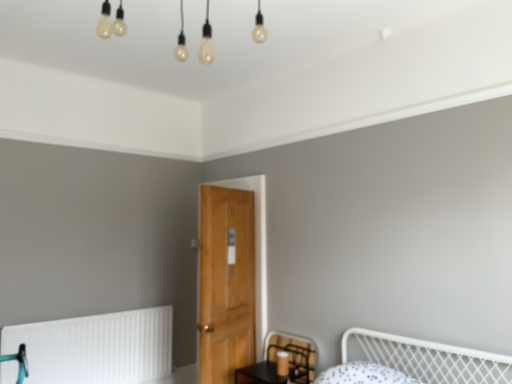
Question: Does black mesh swivel chair at lower center turn towards white matte radiator at lower left?

Choices:
 (A) no
 (B) yes

Answer: (A)

Question: From a real-world perspective, is black mesh swivel chair at lower center located beneath white matte radiator at lower left?

Choices:
 (A) no
 (B) yes

Answer: (A)

Question: Can you confirm if black mesh swivel chair at lower center is bigger than white matte radiator at lower left?

Choices:
 (A) no
 (B) yes

Answer: (A)

Question: Is black mesh swivel chair at lower center surrounding white matte radiator at lower left?

Choices:
 (A) no
 (B) yes

Answer: (A)

Question: From a real-world perspective, is black mesh swivel chair at lower center on top of white matte radiator at lower left?

Choices:
 (A) yes
 (B) no

Answer: (A)

Question: From a real-world perspective, is wooden door at center positioned above or below white matte radiator at lower left?

Choices:
 (A) above
 (B) below

Answer: (A)

Question: From the image's perspective, is wooden door at center located above or below white matte radiator at lower left?

Choices:
 (A) above
 (B) below

Answer: (A)

Question: Is wooden door at center bigger or smaller than white matte radiator at lower left?

Choices:
 (A) big
 (B) small

Answer: (A)

Question: Looking at their shapes, would you say wooden door at center is wider or thinner than white matte radiator at lower left?

Choices:
 (A) thin
 (B) wide

Answer: (B)

Question: Choose the correct answer: Is white matte radiator at lower left inside wooden door at center or outside it?

Choices:
 (A) outside
 (B) inside

Answer: (A)

Question: In terms of height, does white matte radiator at lower left look taller or shorter compared to wooden door at center?

Choices:
 (A) tall
 (B) short

Answer: (B)

Question: Is point (105, 377) positioned closer to the camera than point (264, 278)?

Choices:
 (A) farther
 (B) closer

Answer: (B)

Question: Is white matte radiator at lower left wider or thinner than wooden door at center?

Choices:
 (A) wide
 (B) thin

Answer: (B)

Question: Is black mesh swivel chair at lower center inside the boundaries of white matte radiator at lower left, or outside?

Choices:
 (A) inside
 (B) outside

Answer: (B)

Question: From a real-world perspective, is black mesh swivel chair at lower center above or below white matte radiator at lower left?

Choices:
 (A) below
 (B) above

Answer: (B)